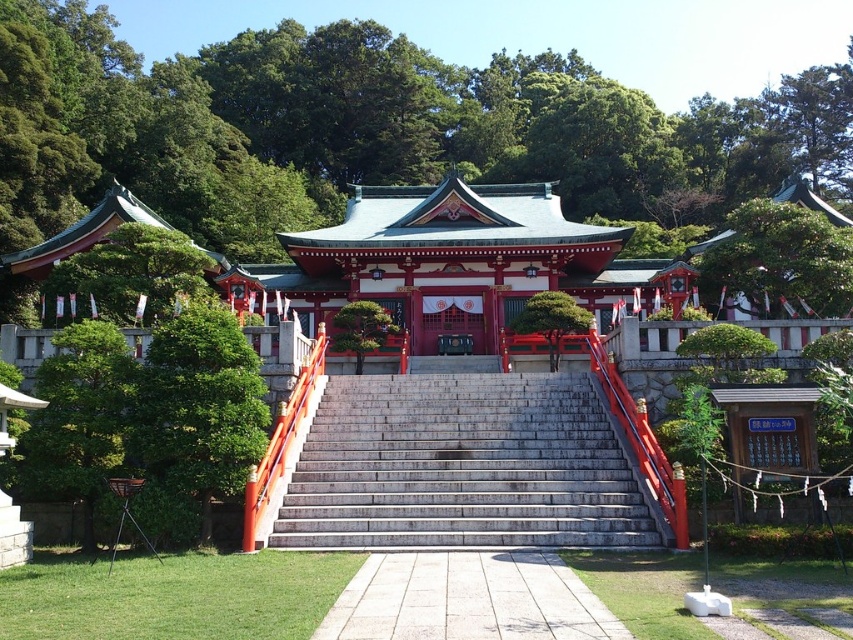
Who is more forward, (759,216) or (136,323)?

Positioned in front is point (136,323).

Can you confirm if green leafy tree at upper center is smaller than green leafy tree at left?

No.

This screenshot has width=853, height=640. Find the location of `green leafy tree at upper center`. green leafy tree at upper center is located at coordinates (781, 259).

Is gray stone stairs at center thinner than green glossy tree at center?

Incorrect, gray stone stairs at center's width is not less than green glossy tree at center's.

This screenshot has width=853, height=640. Describe the element at coordinates (465, 467) in the screenshot. I see `gray stone stairs at center` at that location.

Locate an element on the screen. gray stone stairs at center is located at coordinates (465, 467).

Who is positioned more to the left, gray stone stairs at center or green leafy tree at upper center?

gray stone stairs at center is more to the left.

Is gray stone stairs at center closer to the viewer compared to green leafy tree at upper center?

Yes.

In order to click on gray stone stairs at center in this screenshot , I will do `click(465, 467)`.

Locate an element on the screen. gray stone stairs at center is located at coordinates (465, 467).